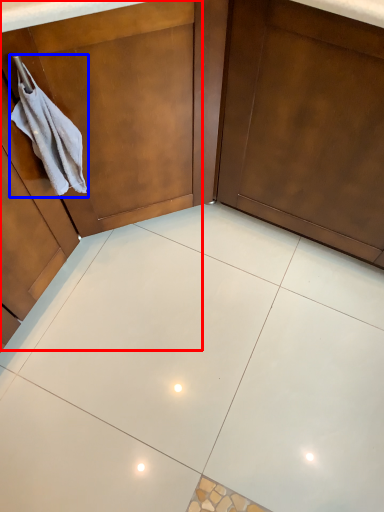
Question: Among these objects, which one is farthest to the camera, dresser (highlighted by a red box) or hand towel (highlighted by a blue box)?

Choices:
 (A) dresser
 (B) hand towel

Answer: (B)